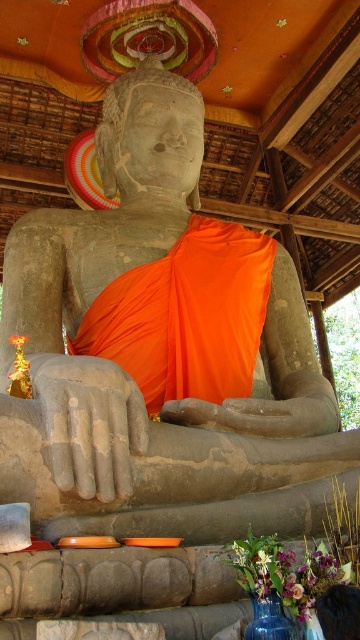
You are an art student analyzing the composition of the Buddha statue scene. Based on the positioning of the orange silk robe at center and the smooth dark wood frame at lower right, which object is positioned more to the east if the scene is oriented with the entrance facing north?

The orange silk robe at center is positioned more to the east because it is to the left of the smooth dark wood frame at lower right, and since the entrance faces north, left would correspond to the east direction.

You are a tour guide leading a group to the statue of Buddha. You want to ensure that your group can clearly see both the orange silk robe at center and the smooth dark wood frame at lower right from a single vantage point. Given that the minimum distance required to see both objects clearly is 15 meters, can your group achieve this?

The orange silk robe at center is 17.20 meters from smooth dark wood frame at lower right. Since the required minimum distance is 15 meters, the group can clearly see both objects from a single vantage point because the distance between them is sufficient.